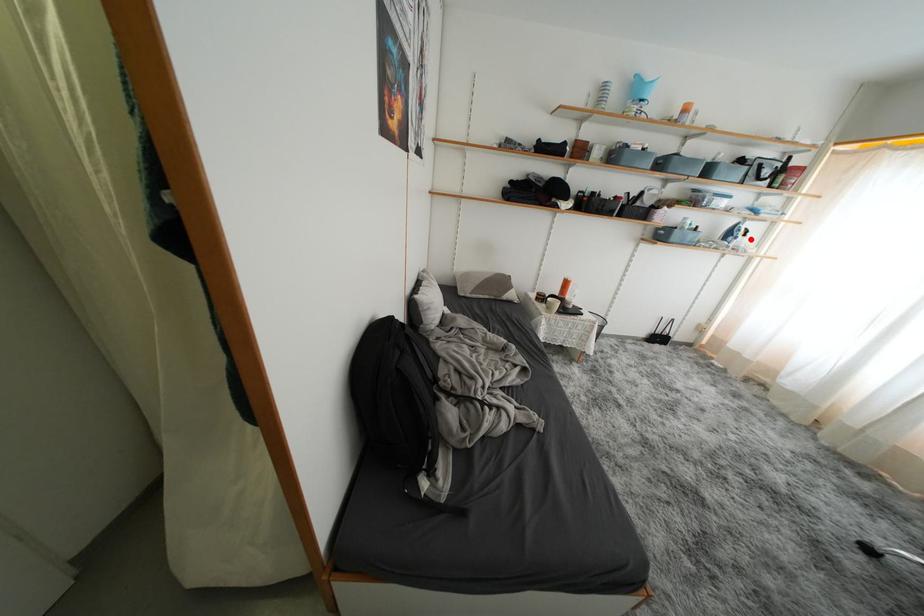
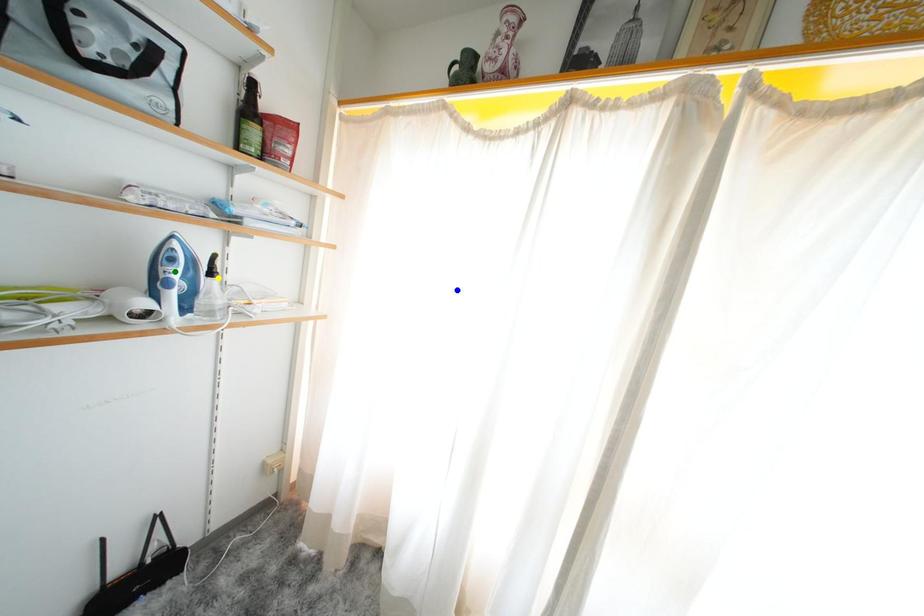
Question: I am providing you with two images of the same scene from different viewpoints. A red point is marked on the first image. You are given multiple points on the second image. Can you choose the point in image 2 that corresponds to the point in image 1?

Choices:
 (A) blue point
 (B) yellow point
 (C) green point

Answer: (B)